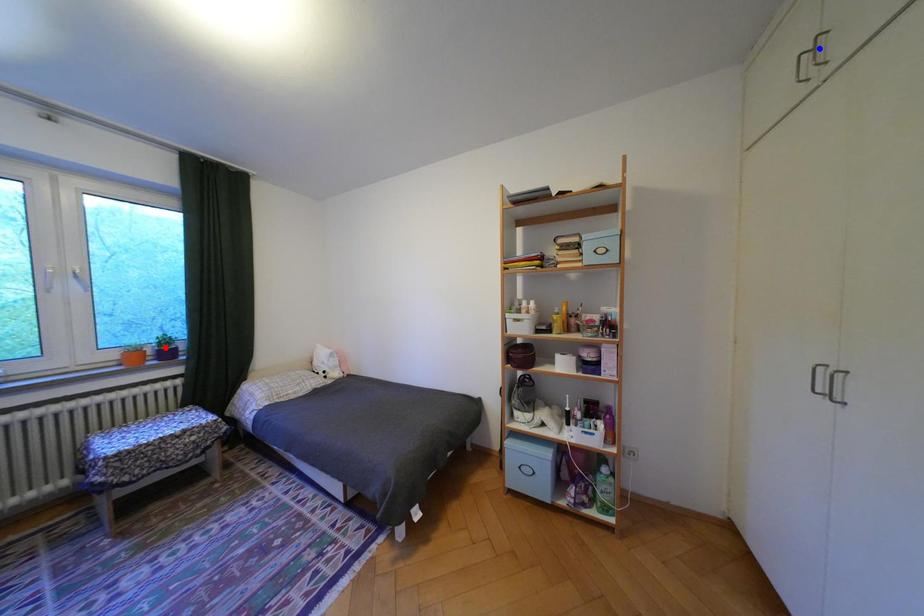
Question: In the image, two points are highlighted. Which point is nearer to the camera? Reply with the corresponding letter.

Choices:
 (A) blue point
 (B) red point

Answer: (A)